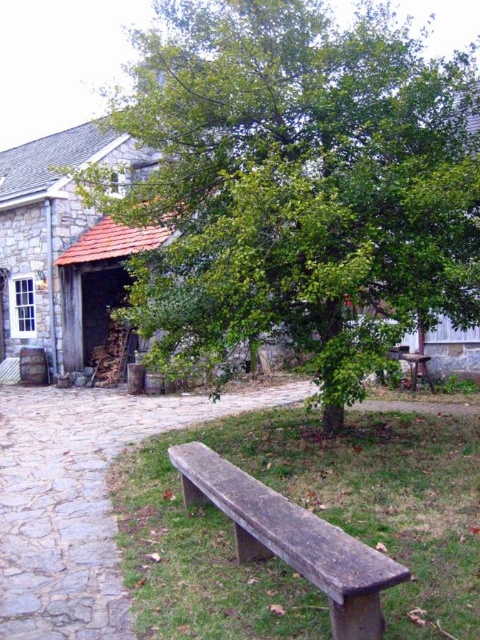
Can you confirm if green leafy tree at center is positioned to the right of brown stone bench at center?

Correct, you'll find green leafy tree at center to the right of brown stone bench at center.

Does green leafy tree at center have a greater height compared to brown stone bench at center?

Correct, green leafy tree at center is much taller as brown stone bench at center.

The height and width of the screenshot is (640, 480). Find the location of `green leafy tree at center`. green leafy tree at center is located at coordinates (299, 182).

The image size is (480, 640). What do you see at coordinates (292, 540) in the screenshot? I see `weathered wood bench at lower center` at bounding box center [292, 540].

Who is positioned more to the left, weathered wood bench at lower center or wooden bench at center?

Positioned to the left is weathered wood bench at lower center.

Locate an element on the screen. weathered wood bench at lower center is located at coordinates (292, 540).

This screenshot has width=480, height=640. Find the location of `weathered wood bench at lower center`. weathered wood bench at lower center is located at coordinates (292, 540).

Which is below, green leafy tree at center or weathered wood bench at lower center?

Positioned lower is weathered wood bench at lower center.

Which is in front, point (358, 289) or point (407, 577)?

Point (407, 577)

The width and height of the screenshot is (480, 640). Identify the location of green leafy tree at center. (299, 182).